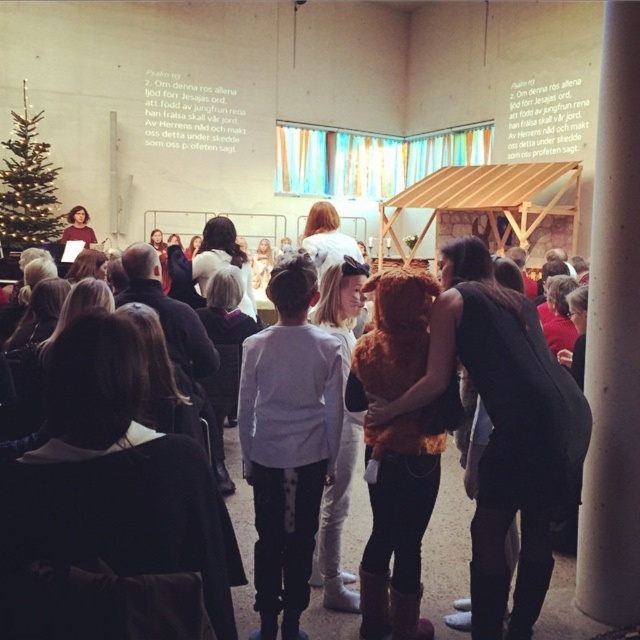
Can you confirm if brown furry coat at center is positioned to the left of matte black shirt at left?

Incorrect, brown furry coat at center is not on the left side of matte black shirt at left.

Which is in front, point (416, 520) or point (77, 236)?

Point (416, 520) is in front.

You are a GUI agent. You are given a task and a screenshot of the screen. Output one action in this format:
    pyautogui.click(x=<x>, y=<y>)
    Task: Click on the brown furry coat at center
    
    Given the screenshot: What is the action you would take?
    pyautogui.click(x=397, y=452)

Who is higher up, brown furry costume at center or white soft sweater at center?

brown furry costume at center is higher up.

Is point (509, 388) farther from camera compared to point (300, 582)?

No, (509, 388) is closer to viewer.

Which is behind, point (428, 348) or point (276, 280)?

The point (276, 280) is more distant.

This screenshot has width=640, height=640. Identify the location of brown furry costume at center. (502, 432).

Can you confirm if white fur coat at center is smaller than matte black dress at center?

Correct, white fur coat at center occupies less space than matte black dress at center.

Is white fur coat at center wider than matte black dress at center?

No.

Where is `white fur coat at center`? The width and height of the screenshot is (640, 640). white fur coat at center is located at coordinates 337,524.